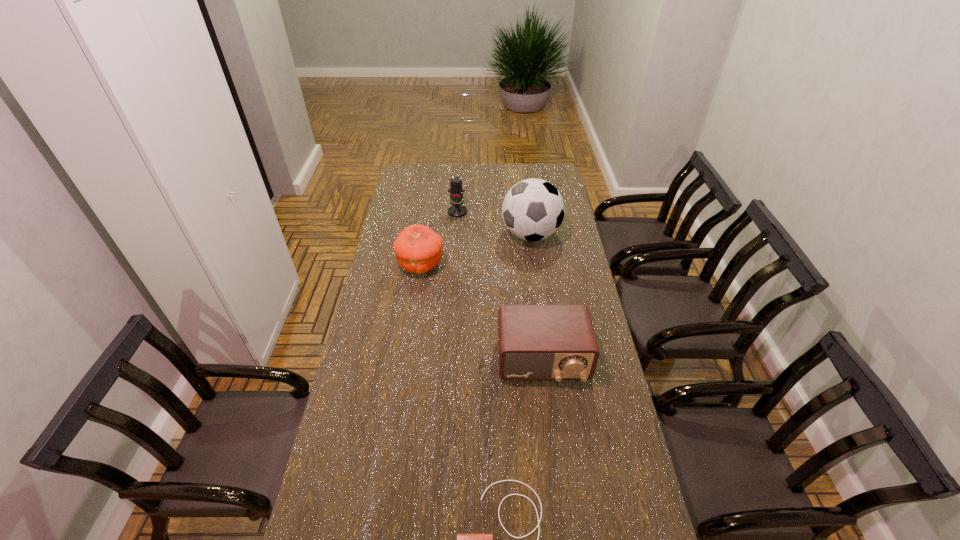
I want to click on the tallest object, so click(x=533, y=209).

Find the location of `microphone`. microphone is located at coordinates (457, 210).

The width and height of the screenshot is (960, 540). What are the coordinates of `pumpkin` in the screenshot? It's located at (418, 248).

At what (x,y) coordinates should I click in order to perform the action: click on the fourth farthest object. Please return your answer as a coordinate pair (x, y). This screenshot has height=540, width=960. Looking at the image, I should click on (535, 342).

Locate an element on the screen. The height and width of the screenshot is (540, 960). the farther radio receiver is located at coordinates (535, 342).

The image size is (960, 540). Find the location of `vacant space situated on the main logo of the soccer ball`. vacant space situated on the main logo of the soccer ball is located at coordinates (451, 235).

Where is `free space located 0.080m on the main logo of the soccer ball`? The height and width of the screenshot is (540, 960). free space located 0.080m on the main logo of the soccer ball is located at coordinates (484, 235).

At what (x,y) coordinates should I click in order to perform the action: click on vacant area located on the main logo of the soccer ball. Please return your answer as a coordinate pair (x, y). This screenshot has height=540, width=960. Looking at the image, I should click on (420, 235).

Where is `vacant area located on the side of the microphone with the red ring`? vacant area located on the side of the microphone with the red ring is located at coordinates [x=457, y=225].

Locate an element on the screen. The image size is (960, 540). free spot located on the back of the pumpkin is located at coordinates (427, 220).